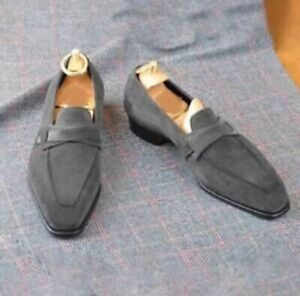
Identify the location of cloth background. (158, 206).